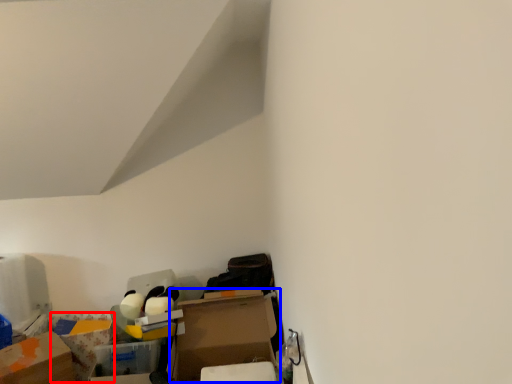
Question: Which object appears farthest to the camera in this image, storage box (highlighted by a red box) or cardboard box (highlighted by a blue box)?

Choices:
 (A) storage box
 (B) cardboard box

Answer: (A)